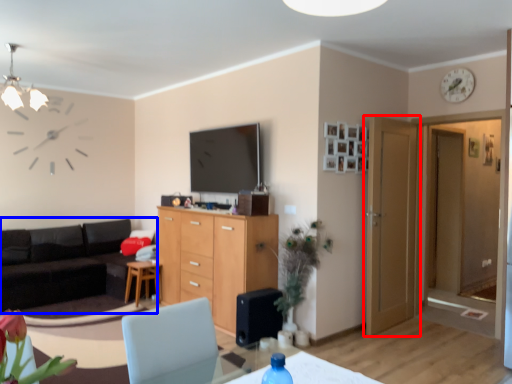
Question: Which object is closer to the camera taking this photo, door (highlighted by a red box) or studio couch (highlighted by a blue box)?

Choices:
 (A) door
 (B) studio couch

Answer: (A)